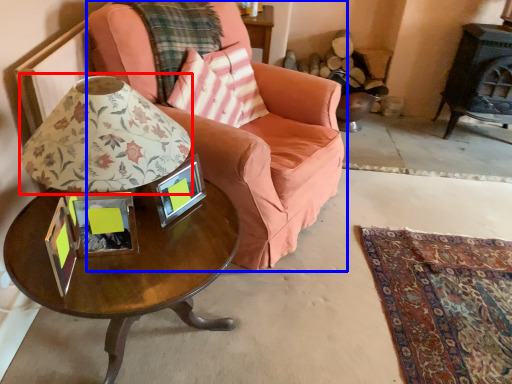
Question: Which object appears farthest to the camera in this image, table lamp (highlighted by a red box) or chair (highlighted by a blue box)?

Choices:
 (A) table lamp
 (B) chair

Answer: (B)